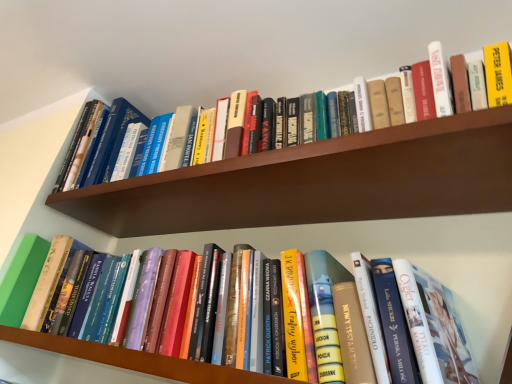
Question: Considering the positions of hardcover book at upper center, the second book in the bottom-to-top sequence, and wooden bookshelf at upper center, the 2th shelf in the bottom-to-top sequence, in the image, is hardcover book at upper center, the second book in the bottom-to-top sequence, taller or shorter than wooden bookshelf at upper center, the 2th shelf in the bottom-to-top sequence,?

Choices:
 (A) tall
 (B) short

Answer: (A)

Question: Is hardcover book at upper center, the second book in the bottom-to-top sequence, in front of or behind wooden bookshelf at upper center, the 2th shelf in the bottom-to-top sequence, in the image?

Choices:
 (A) front
 (B) behind

Answer: (A)

Question: Estimate the real-world distances between objects in this image. Which object is farther from the hardcover book at center, the 2th book when ordered from top to bottom?

Choices:
 (A) hardcover book at upper center, which is counted as the first book, starting from the top
 (B) hardcover books at center, placed as the first shelf when sorted from bottom to top
 (C) wooden bookshelf at upper center, positioned as the 1th shelf in top-to-bottom order

Answer: (A)

Question: Which of these objects is positioned closest to the wooden bookshelf at upper center, positioned as the 1th shelf in top-to-bottom order?

Choices:
 (A) hardcover book at center, the 2th book when ordered from top to bottom
 (B) hardcover books at center, the 2th shelf from the top
 (C) hardcover book at upper center, the second book in the bottom-to-top sequence

Answer: (C)